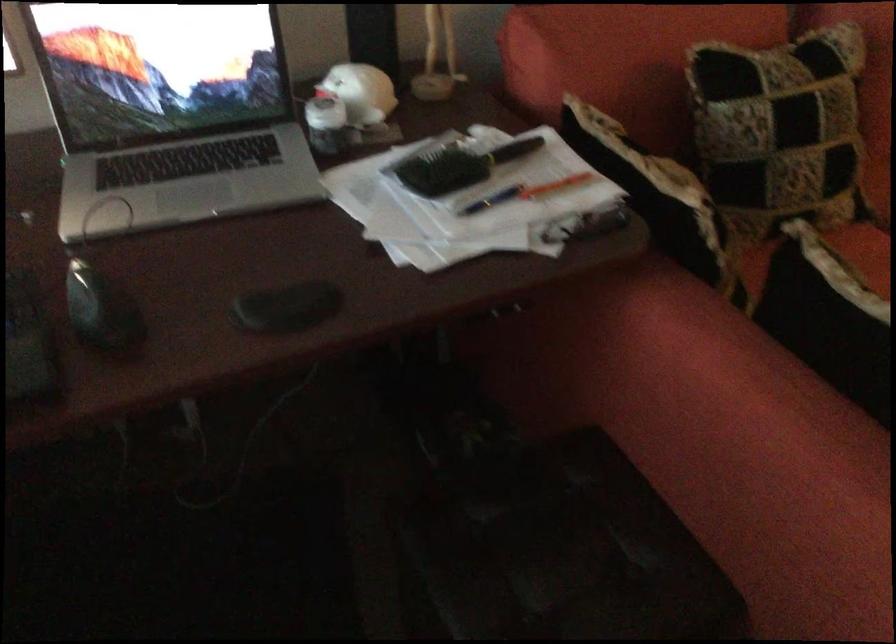
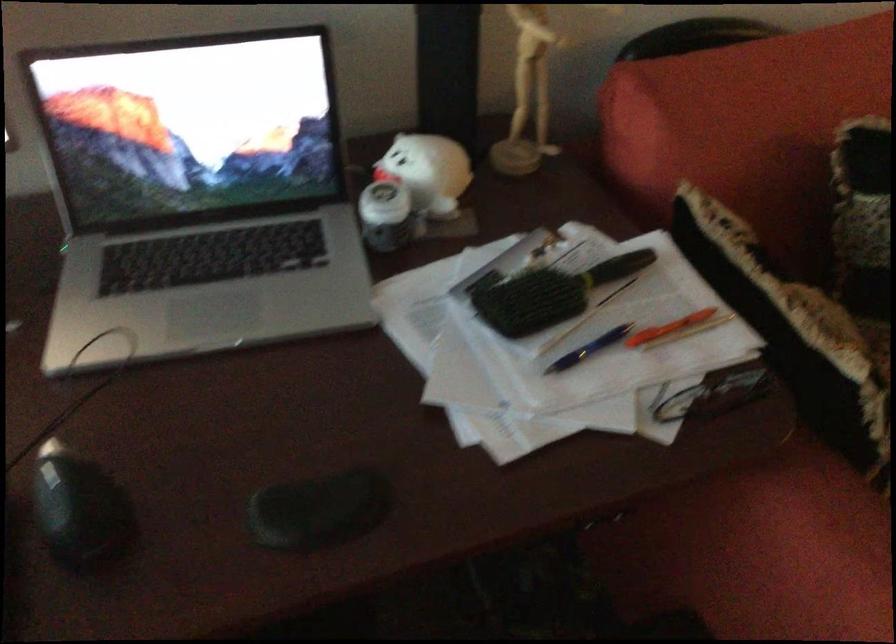
The point at (99, 310) is marked in the first image. Where is the corresponding point in the second image?

(80, 511)